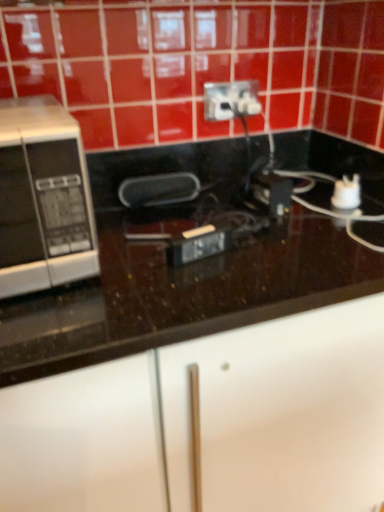
Question: Should I look upward or downward to see silver/black microwave at left?

Choices:
 (A) up
 (B) down

Answer: (A)

Question: Is silver/black microwave at left wider than black glossy countertop at center?

Choices:
 (A) no
 (B) yes

Answer: (A)

Question: Would you say silver/black microwave at left contains black glossy countertop at center?

Choices:
 (A) yes
 (B) no

Answer: (B)

Question: From the image's perspective, is silver/black microwave at left on top of black glossy countertop at center?

Choices:
 (A) no
 (B) yes

Answer: (B)

Question: Can you confirm if silver/black microwave at left is positioned to the left of black glossy countertop at center?

Choices:
 (A) yes
 (B) no

Answer: (A)

Question: Can you confirm if silver/black microwave at left is positioned to the right of black glossy countertop at center?

Choices:
 (A) yes
 (B) no

Answer: (B)

Question: Is silver/black microwave at left located outside black glossy countertop at center?

Choices:
 (A) yes
 (B) no

Answer: (B)

Question: Does white plastic power plugs and sockets at upper center have a larger size compared to black glossy countertop at center?

Choices:
 (A) no
 (B) yes

Answer: (A)

Question: Is white plastic power plugs and sockets at upper center touching black glossy countertop at center?

Choices:
 (A) no
 (B) yes

Answer: (A)

Question: Is white plastic power plugs and sockets at upper center looking in the opposite direction of black glossy countertop at center?

Choices:
 (A) no
 (B) yes

Answer: (A)

Question: Can you confirm if white plastic power plugs and sockets at upper center is positioned to the left of black glossy countertop at center?

Choices:
 (A) no
 (B) yes

Answer: (A)

Question: Could black glossy countertop at center be considered to be inside white plastic power plugs and sockets at upper center?

Choices:
 (A) yes
 (B) no

Answer: (B)

Question: From a real-world perspective, is white plastic power plugs and sockets at upper center on top of black glossy countertop at center?

Choices:
 (A) no
 (B) yes

Answer: (B)

Question: Is white plastic power plugs and sockets at upper center smaller than silver/black microwave at left?

Choices:
 (A) no
 (B) yes

Answer: (B)